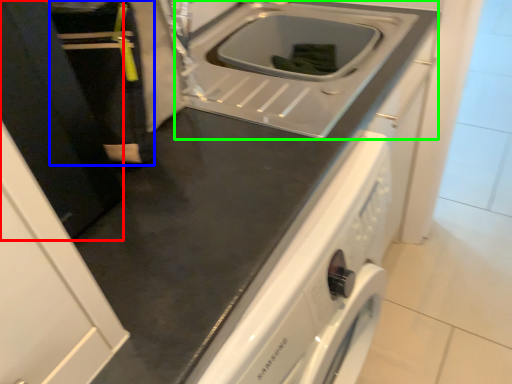
Question: Based on their relative distances, which object is nearer to door (highlighted by a red box)? Choose from person (highlighted by a blue box) and sink (highlighted by a green box).

Choices:
 (A) person
 (B) sink

Answer: (A)